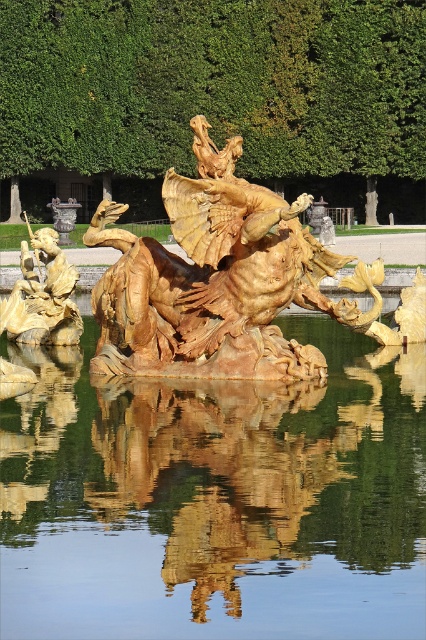
Who is positioned more to the left, green leafy hedge at upper center or gold polished statue at left?

gold polished statue at left

Is green leafy hedge at upper center positioned in front of gold polished statue at left?

No.

At what (x,y) coordinates should I click in order to perform the action: click on green leafy hedge at upper center. Please return your answer as a coordinate pair (x, y). This screenshot has width=426, height=640. Looking at the image, I should click on (213, 84).

Image resolution: width=426 pixels, height=640 pixels. I want to click on transparent water at center, so pyautogui.click(x=215, y=499).

Between point (218, 529) and point (247, 314), which one is positioned in front?

Point (218, 529) is more forward.

Where is `transparent water at center`? This screenshot has width=426, height=640. transparent water at center is located at coordinates (215, 499).

Can you confirm if transparent water at center is positioned to the right of gold reflective water at center?

No, transparent water at center is not to the right of gold reflective water at center.

Who is taller, transparent water at center or gold reflective water at center?

transparent water at center

Who is more forward, (138, 433) or (302, 422)?

Positioned in front is point (138, 433).

Where is `transparent water at center`? The image size is (426, 640). transparent water at center is located at coordinates (215, 499).